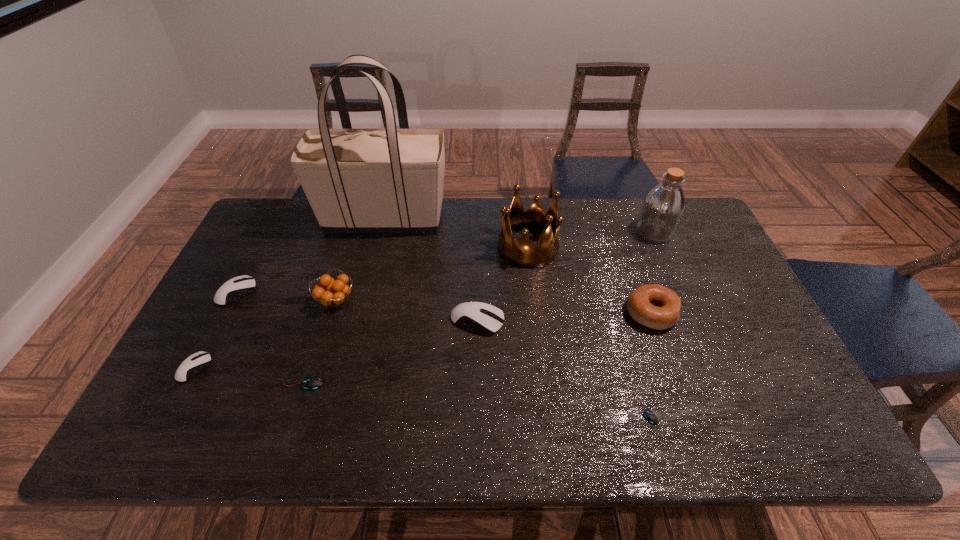
This screenshot has width=960, height=540. Find the location of `the seventh tallest object`. the seventh tallest object is located at coordinates coord(240,286).

Where is `the nearest white mouse`? Image resolution: width=960 pixels, height=540 pixels. the nearest white mouse is located at coordinates (191, 366).

Where is `the eighth tallest object`? the eighth tallest object is located at coordinates (191, 366).

Identify the location of the third mouse from left to right. (312, 383).

Find the location of a particular element. the farther black mouse is located at coordinates (312, 383).

Locate an element on the screen. the nearer black mouse is located at coordinates (650, 416).

Locate an element on the screen. This screenshot has width=960, height=540. the nearest mouse is located at coordinates (650, 416).

Identify the location of free space located 0.190m with handles facing forward on the gray shopping bag. (503, 219).

The width and height of the screenshot is (960, 540). I want to click on vacant space located 0.120m on the front of the second tallest object, so click(671, 271).

The width and height of the screenshot is (960, 540). I want to click on free space located 0.320m on the front of the third tallest object, so (x=540, y=356).